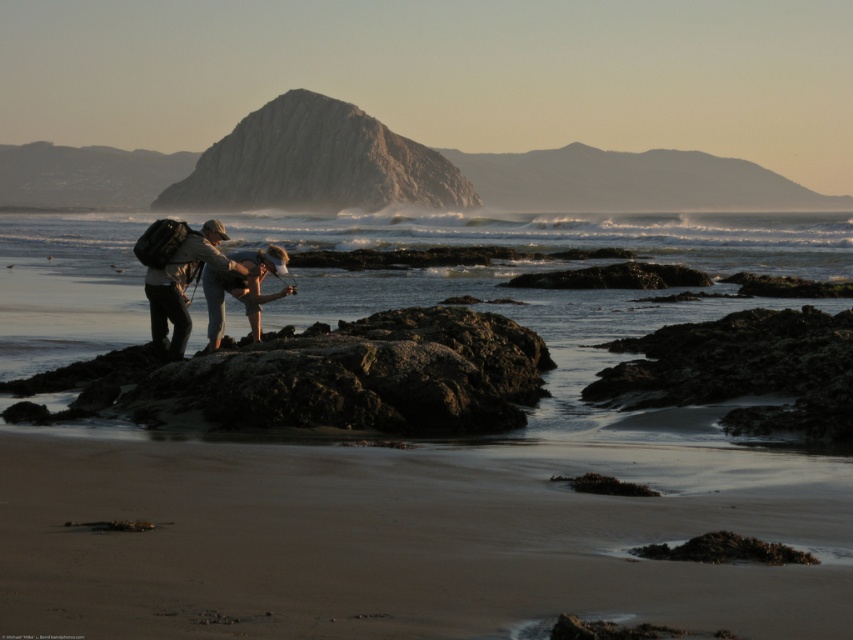
Is smooth sand beach at center in front of matte khaki pants at center?

Yes, it is.

Is point (503, 545) positioned in front of point (184, 321)?

Yes.

This screenshot has width=853, height=640. What do you see at coordinates (408, 532) in the screenshot? I see `smooth sand beach at center` at bounding box center [408, 532].

You are a GUI agent. You are given a task and a screenshot of the screen. Output one action in this format:
    pyautogui.click(x=<x>, y=<y>)
    Task: Click on the smooth sand beach at center
    This screenshot has width=853, height=640.
    Given the screenshot: What is the action you would take?
    pyautogui.click(x=408, y=532)

Does rugged granite rock at center appear on the right side of matte khaki shorts at center?

In fact, rugged granite rock at center is to the left of matte khaki shorts at center.

Where is `rugged granite rock at center`? This screenshot has height=640, width=853. rugged granite rock at center is located at coordinates (316, 163).

Who is more distant from viewer, (245, 116) or (236, 278)?

The point (245, 116) is behind.

You are a GUI agent. You are given a task and a screenshot of the screen. Output one action in this format:
    pyautogui.click(x=<x>, y=<y>)
    Task: Click on the rugged granite rock at center
    Image resolution: width=853 pixels, height=640 pixels.
    Given the screenshot: What is the action you would take?
    pyautogui.click(x=316, y=163)

Locate an element on the screen. The height and width of the screenshot is (640, 853). smooth sand beach at center is located at coordinates (408, 532).

Who is more distant from viewer, (402, 458) or (448, 173)?

The point (448, 173) is behind.

Consider the image. Who is more distant from viewer, [234,477] or [256,152]?

Positioned behind is point [256,152].

Where is `smooth sand beach at center`? smooth sand beach at center is located at coordinates (408, 532).